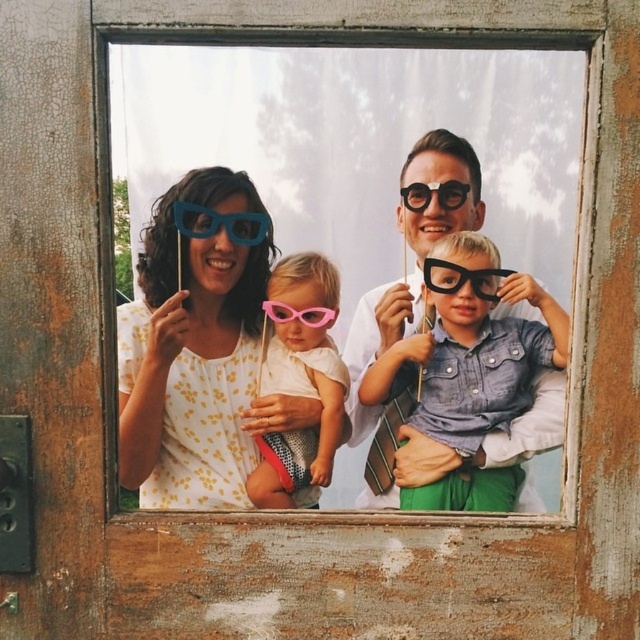
You are a photographer trying to capture a closeup of the glasses in the scene. You have a camera with a macro lens that can only focus on objects smaller than 10 cm. Which of the two glasses, the pink matte sunglasses at center or the black plastic glasses at center, can you focus on with your macro lens?

The black plastic glasses at center is smaller than the pink matte sunglasses at center. Since the macro lens can only focus on objects smaller than 10 cm, you should use it on the black plastic glasses at center.

You are standing in front of the rustic wooden door with the family photo displayed through its window. There are two points marked on the window frame at coordinates point (170, 324) and point (177, 323). Which of these points is nearer to you?

Point (170, 324) is closer to the viewer than point (177, 323).